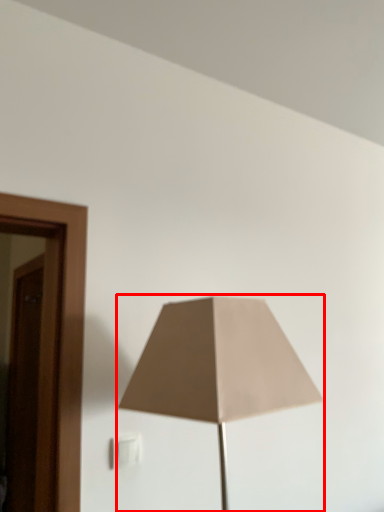
Question: In this image, where is lamp (annotated by the red box) located relative to electric outlet?

Choices:
 (A) left
 (B) right

Answer: (B)